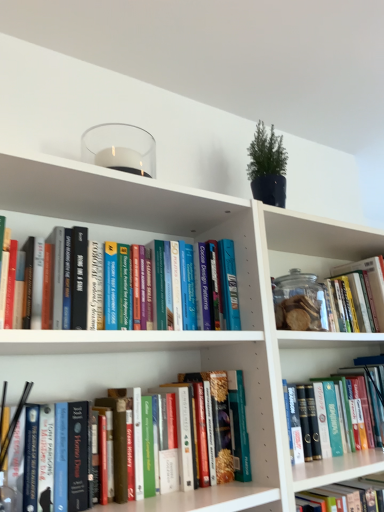
Question: Is transparent glass jar at center-right positioned beyond the bounds of hardcover book at center, placed as the third book when sorted from bottom to top?

Choices:
 (A) no
 (B) yes

Answer: (B)

Question: Is transparent glass jar at center-right thinner than hardcover book at center, which ranks as the third book in top-to-bottom order?

Choices:
 (A) no
 (B) yes

Answer: (B)

Question: Is the position of transparent glass jar at center-right more distant than that of hardcover book at center, placed as the third book when sorted from bottom to top?

Choices:
 (A) yes
 (B) no

Answer: (A)

Question: Does transparent glass jar at center-right have a greater width compared to hardcover book at center, which ranks as the third book in top-to-bottom order?

Choices:
 (A) no
 (B) yes

Answer: (A)

Question: Is transparent glass jar at center-right smaller than hardcover book at center, which ranks as the third book in top-to-bottom order?

Choices:
 (A) yes
 (B) no

Answer: (A)

Question: From the image's perspective, would you say transparent glass jar at center-right is positioned over hardcover book at center, placed as the third book when sorted from bottom to top?

Choices:
 (A) yes
 (B) no

Answer: (A)

Question: From a real-world perspective, is hardcover book at center, positioned as the second book in bottom-to-top order, physically above transparent glass jar at center-right?

Choices:
 (A) yes
 (B) no

Answer: (B)

Question: Does hardcover book at center, positioned as the second book in bottom-to-top order, come in front of transparent glass jar at center-right?

Choices:
 (A) no
 (B) yes

Answer: (B)

Question: From a real-world perspective, is hardcover book at center, which is counted as the 4th book, starting from the top, located beneath transparent glass jar at center-right?

Choices:
 (A) yes
 (B) no

Answer: (A)

Question: Can transparent glass jar at center-right be found inside hardcover book at center, which is counted as the 4th book, starting from the top?

Choices:
 (A) no
 (B) yes

Answer: (A)

Question: Is hardcover book at center, positioned as the second book in bottom-to-top order, positioned beyond the bounds of transparent glass jar at center-right?

Choices:
 (A) yes
 (B) no

Answer: (A)

Question: Can you confirm if hardcover book at center, positioned as the second book in bottom-to-top order, is positioned to the left of transparent glass jar at center-right?

Choices:
 (A) yes
 (B) no

Answer: (B)

Question: From the image's perspective, would you say white matte bookcase at upper center is shown under transparent glass jar at center-right?

Choices:
 (A) yes
 (B) no

Answer: (A)